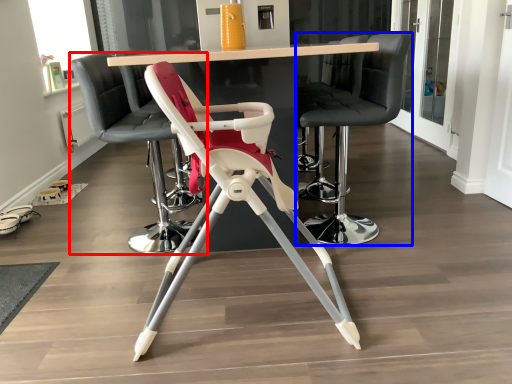
Question: Among these objects, which one is farthest to the camera, chair (highlighted by a red box) or chair (highlighted by a blue box)?

Choices:
 (A) chair
 (B) chair

Answer: (A)